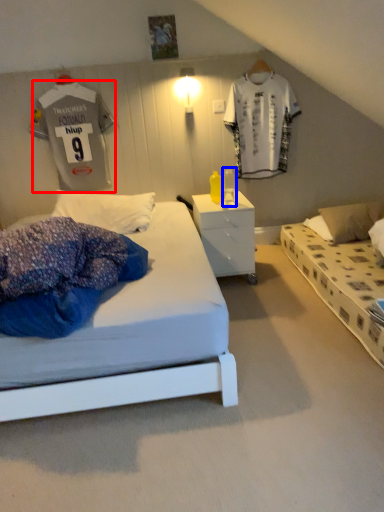
Question: Which object is closer to the camera taking this photo, t shirt (highlighted by a red box) or table lamp (highlighted by a blue box)?

Choices:
 (A) t shirt
 (B) table lamp

Answer: (B)